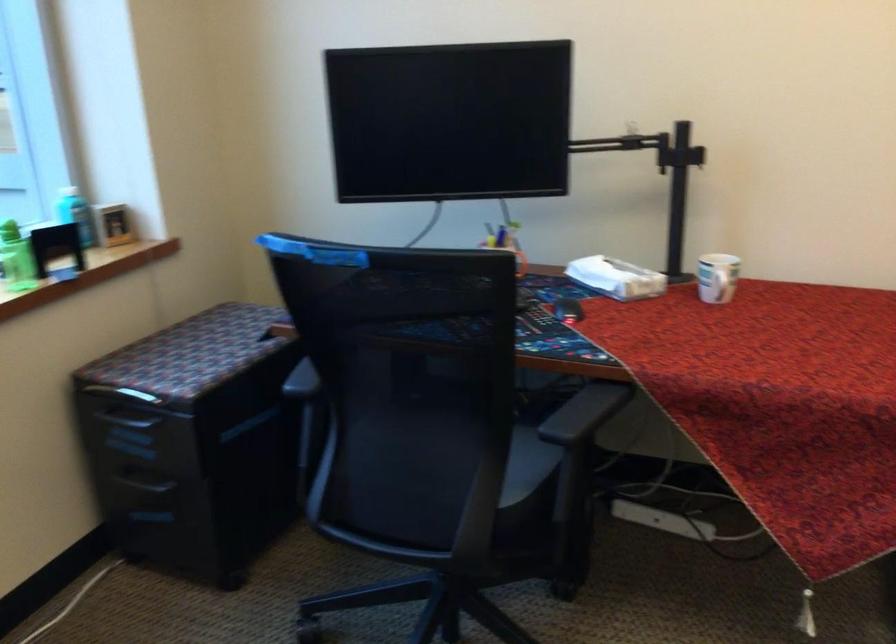
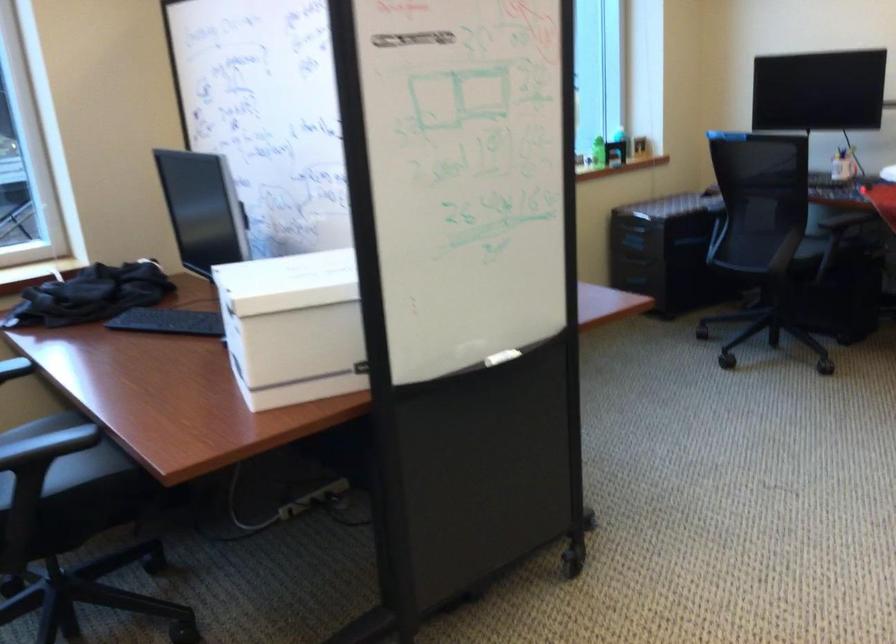
The point at (511,498) is marked in the first image. Where is the corresponding point in the second image?

(811, 248)